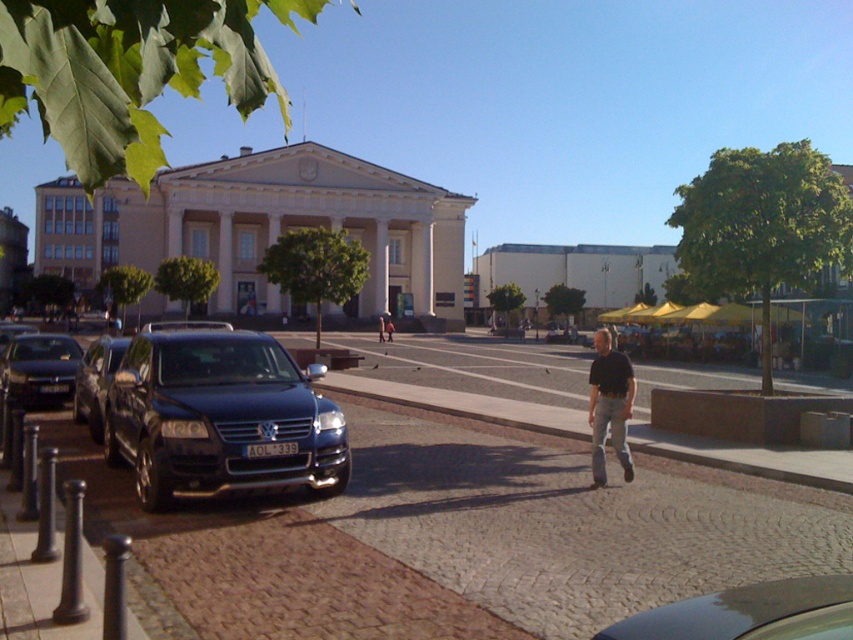
Question: Does shiny black car at center have a smaller size compared to dark blue jeans at center?

Choices:
 (A) yes
 (B) no

Answer: (A)

Question: Which of the following is the closest to the observer?

Choices:
 (A) cobblestone pavement at center
 (B) shiny black car at center
 (C) shiny black suv at left
 (D) shiny dark blue suv at left

Answer: (B)

Question: Is shiny dark blue suv at left above dark blue shirt at center?

Choices:
 (A) no
 (B) yes

Answer: (B)

Question: Which point is farther to the camera?

Choices:
 (A) dark blue jeans at center
 (B) shiny black suv at left

Answer: (A)

Question: From the image, what is the correct spatial relationship of shiny dark blue suv at left in relation to matte black car at left?

Choices:
 (A) right
 (B) left

Answer: (A)

Question: Which of the following is the closest to the observer?

Choices:
 (A) coord(724,600)
 (B) coord(96,426)

Answer: (A)